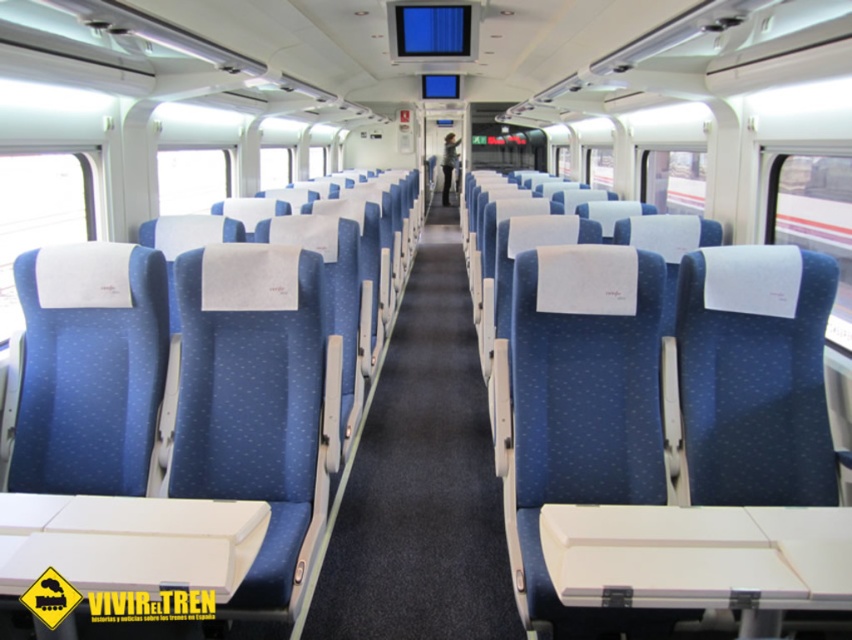
Question: Which point is farther to the camera?

Choices:
 (A) (350, 516)
 (B) (448, 202)

Answer: (B)

Question: Which point is farther to the camera?

Choices:
 (A) (413, 330)
 (B) (446, 177)

Answer: (B)

Question: Does blue fabric aisle at center have a larger size compared to blue fabric coach at center?

Choices:
 (A) no
 (B) yes

Answer: (B)

Question: Does blue fabric aisle at center appear on the right side of blue fabric coach at center?

Choices:
 (A) yes
 (B) no

Answer: (B)

Question: Can you confirm if blue fabric aisle at center is positioned above blue fabric coach at center?

Choices:
 (A) no
 (B) yes

Answer: (A)